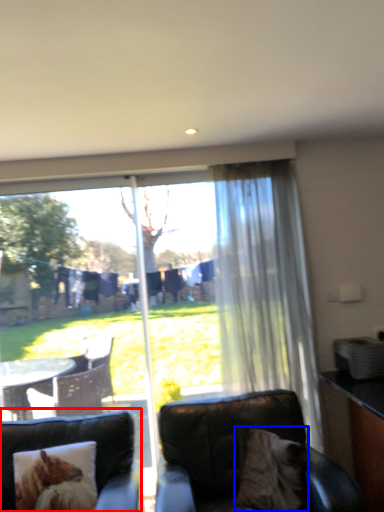
Question: Which point is closer to the camera, studio couch (highlighted by a red box) or pillow (highlighted by a blue box)?

Choices:
 (A) studio couch
 (B) pillow

Answer: (A)